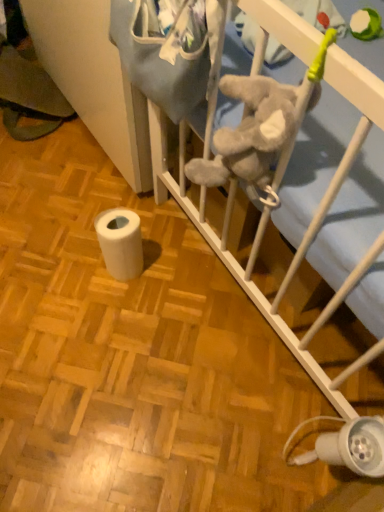
Question: Should I look upward or downward to see white soft infant bed at center?

Choices:
 (A) up
 (B) down

Answer: (A)

Question: Does white soft infant bed at center have a larger size compared to white matte toilet paper at lower left?

Choices:
 (A) yes
 (B) no

Answer: (A)

Question: From a real-world perspective, is white soft infant bed at center located higher than white matte toilet paper at lower left?

Choices:
 (A) no
 (B) yes

Answer: (A)

Question: From the image's perspective, is white soft infant bed at center on top of white matte toilet paper at lower left?

Choices:
 (A) no
 (B) yes

Answer: (B)

Question: Would you say white soft infant bed at center contains white matte toilet paper at lower left?

Choices:
 (A) no
 (B) yes

Answer: (A)

Question: Does white soft infant bed at center have a greater width compared to white matte toilet paper at lower left?

Choices:
 (A) yes
 (B) no

Answer: (A)

Question: Is white soft infant bed at center not close to white matte toilet paper at lower left?

Choices:
 (A) no
 (B) yes

Answer: (A)

Question: From a real-world perspective, is white matte toilet paper at lower left physically above white plastic lamp at lower right?

Choices:
 (A) yes
 (B) no

Answer: (B)

Question: Is white matte toilet paper at lower left looking in the opposite direction of white plastic lamp at lower right?

Choices:
 (A) no
 (B) yes

Answer: (A)

Question: Is white matte toilet paper at lower left thinner than white plastic lamp at lower right?

Choices:
 (A) yes
 (B) no

Answer: (A)

Question: Would you say white plastic lamp at lower right is part of white matte toilet paper at lower left's contents?

Choices:
 (A) no
 (B) yes

Answer: (A)

Question: Is white matte toilet paper at lower left further to the viewer compared to white plastic lamp at lower right?

Choices:
 (A) yes
 (B) no

Answer: (A)

Question: Is white matte toilet paper at lower left outside white plastic lamp at lower right?

Choices:
 (A) yes
 (B) no

Answer: (A)

Question: Is white plastic lamp at lower right at the left side of white matte toilet paper at lower left?

Choices:
 (A) no
 (B) yes

Answer: (A)